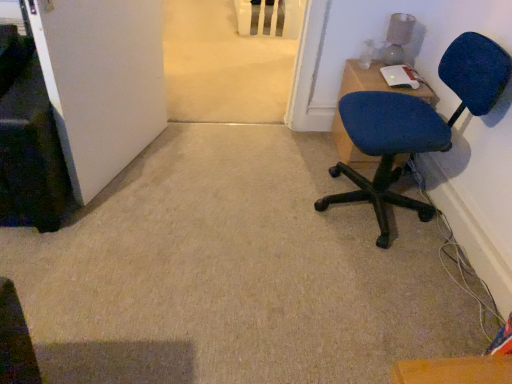
Question: Considering the relative sizes of blue fabric chair at right and blue fabric chair at upper right in the image provided, is blue fabric chair at right wider than blue fabric chair at upper right?

Choices:
 (A) yes
 (B) no

Answer: (A)

Question: From a real-world perspective, is blue fabric chair at right below blue fabric chair at upper right?

Choices:
 (A) no
 (B) yes

Answer: (A)

Question: Does blue fabric chair at right come in front of blue fabric chair at upper right?

Choices:
 (A) no
 (B) yes

Answer: (B)

Question: Is blue fabric chair at right touching blue fabric chair at upper right?

Choices:
 (A) no
 (B) yes

Answer: (A)

Question: Are blue fabric chair at right and blue fabric chair at upper right located far from each other?

Choices:
 (A) yes
 (B) no

Answer: (B)

Question: In terms of size, does blue fabric chair at right appear bigger or smaller than blue fabric chair at upper right?

Choices:
 (A) small
 (B) big

Answer: (B)

Question: From a real-world perspective, is blue fabric chair at right physically located above or below blue fabric chair at upper right?

Choices:
 (A) below
 (B) above

Answer: (B)

Question: From the image's perspective, is blue fabric chair at right positioned above or below blue fabric chair at upper right?

Choices:
 (A) above
 (B) below

Answer: (B)

Question: Is blue fabric chair at right spatially inside blue fabric chair at upper right, or outside of it?

Choices:
 (A) inside
 (B) outside

Answer: (B)

Question: In terms of size, does white matte door at lower left appear bigger or smaller than blue fabric chair at upper right?

Choices:
 (A) small
 (B) big

Answer: (B)

Question: Which is correct: white matte door at lower left is inside blue fabric chair at upper right, or outside of it?

Choices:
 (A) outside
 (B) inside

Answer: (A)

Question: Does point coord(72,170) appear closer or farther from the camera than point coord(379,87)?

Choices:
 (A) farther
 (B) closer

Answer: (B)

Question: From a real-world perspective, is white matte door at lower left physically located above or below blue fabric chair at upper right?

Choices:
 (A) above
 (B) below

Answer: (A)

Question: Visually, is blue fabric chair at upper right positioned to the left or to the right of blue fabric chair at right?

Choices:
 (A) right
 (B) left

Answer: (A)

Question: Does point (331, 127) appear closer or farther from the camera than point (495, 66)?

Choices:
 (A) closer
 (B) farther

Answer: (B)